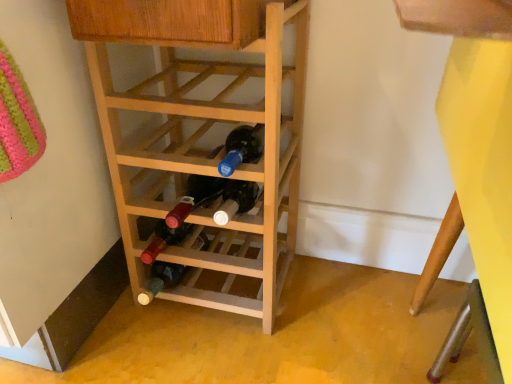
You are a GUI agent. You are given a task and a screenshot of the screen. Output one action in this format:
    pyautogui.click(x=<x>, y=<y>)
    Task: Click on the vacant space to the right of natural wood wine rack at center
    This screenshot has width=512, height=384.
    Given the screenshot: What is the action you would take?
    pyautogui.click(x=338, y=295)